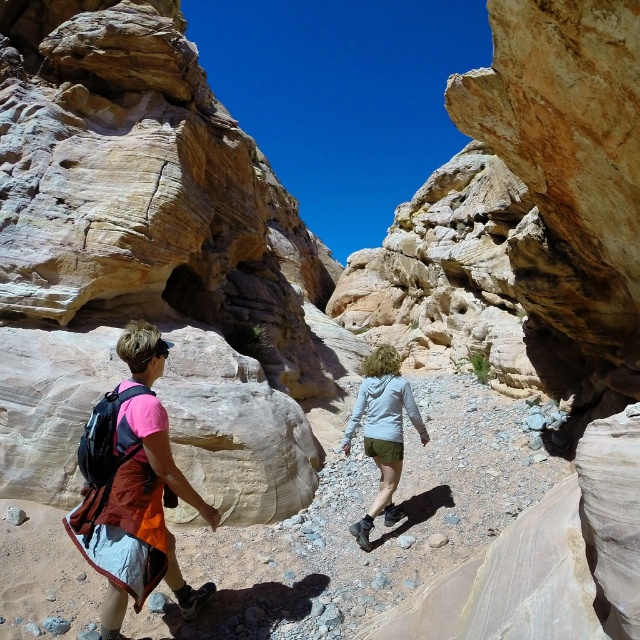
You are a hiker trying to navigate through the canyon. You see two points marked on the ground ahead of you. The first point is at coordinate point (86,536) and the second is at coordinate point (364,528). Which point is closer to you as you stand at the starting point?

Point (86,536) is closer to the viewer than point (364,528), so the first point is closer to you.

You are one of the hikers in the canyon. You notice a matte fabric backpack at left and a white matte jacket at center. Which item is nearer to you as you stand here?

The matte fabric backpack at left is closer to the viewer than the white matte jacket at center, so the backpack is nearer to you.

You are planning to carry both the matte fabric backpack at left and the white matte jacket at center during your hike. Based on their sizes, which item would be more challenging to store in a vertical storage compartment that is only 1 meter tall?

The white matte jacket at center is taller than the matte fabric backpack at left, so it would be more challenging to store in a vertical storage compartment that is only 1 meter tall.